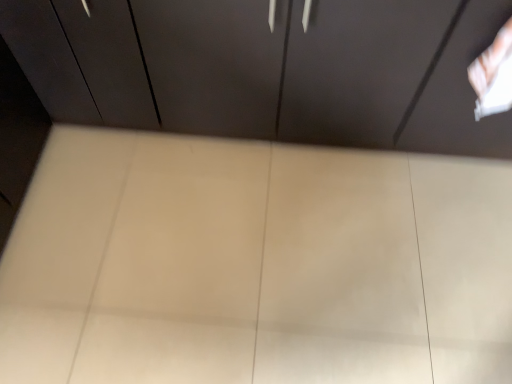
Locate an element on the screen. white glossy plywood at center is located at coordinates (255, 264).

The width and height of the screenshot is (512, 384). What do you see at coordinates (255, 264) in the screenshot?
I see `white glossy plywood at center` at bounding box center [255, 264].

Measure the distance between point (352, 310) and camera.

4.22 feet.

The height and width of the screenshot is (384, 512). What are the coordinates of `matte dark wood cupboard at center` in the screenshot? It's located at (268, 68).

This screenshot has width=512, height=384. What do you see at coordinates (268, 68) in the screenshot?
I see `matte dark wood cupboard at center` at bounding box center [268, 68].

In order to face matte dark wood cupboard at center, should I rotate leftwards or rightwards?

To face it directly, rotate right by 6.460 degrees.

Identify the location of white glossy plywood at center. The width and height of the screenshot is (512, 384). (255, 264).

Based on the photo, considering the positions of objects white glossy plywood at center and matte dark wood cupboard at center in the image provided, who is more to the right, white glossy plywood at center or matte dark wood cupboard at center?

matte dark wood cupboard at center is more to the right.

Is the position of white glossy plywood at center less distant than that of matte dark wood cupboard at center?

No, it is not.

Is point (103, 161) behind point (67, 12)?

Yes.

From the image's perspective, is white glossy plywood at center on top of matte dark wood cupboard at center?

Actually, white glossy plywood at center appears below matte dark wood cupboard at center in the image.

From a real-world perspective, is white glossy plywood at center positioned under matte dark wood cupboard at center based on gravity?

Yes, from a real-world perspective, white glossy plywood at center is under matte dark wood cupboard at center.

In the scene shown: Is white glossy plywood at center thinner than matte dark wood cupboard at center?

Incorrect, the width of white glossy plywood at center is not less than that of matte dark wood cupboard at center.

Considering the sizes of objects white glossy plywood at center and matte dark wood cupboard at center in the image provided, who is shorter, white glossy plywood at center or matte dark wood cupboard at center?

white glossy plywood at center is shorter.

In terms of size, does white glossy plywood at center appear bigger or smaller than matte dark wood cupboard at center?

Considering their sizes, white glossy plywood at center takes up less space than matte dark wood cupboard at center.

Is white glossy plywood at center outside of matte dark wood cupboard at center?

white glossy plywood at center lies outside matte dark wood cupboard at center's area.

Looking at this image, is white glossy plywood at center positioned far away from matte dark wood cupboard at center?

They are positioned close to each other.

Is matte dark wood cupboard at center at the back of white glossy plywood at center?

No, white glossy plywood at center's orientation is not away from matte dark wood cupboard at center.

Where is `plywood that is behind the matte dark wood cupboard at center`? plywood that is behind the matte dark wood cupboard at center is located at coordinates (255, 264).

Between matte dark wood cupboard at center and white glossy plywood at center, which one appears on the right side from the viewer's perspective?

matte dark wood cupboard at center.

Is matte dark wood cupboard at center in front of white glossy plywood at center?

Yes, matte dark wood cupboard at center is in front of white glossy plywood at center.

Which is less distant, (153, 122) or (52, 372)?

Point (153, 122) is farther from the camera than point (52, 372).

From the image's perspective, between matte dark wood cupboard at center and white glossy plywood at center, who is located below?

white glossy plywood at center.

From the picture: From a real-world perspective, is matte dark wood cupboard at center beneath white glossy plywood at center?

No.

Does matte dark wood cupboard at center have a lesser width compared to white glossy plywood at center?

Correct, the width of matte dark wood cupboard at center is less than that of white glossy plywood at center.

Who is shorter, matte dark wood cupboard at center or white glossy plywood at center?

Standing shorter between the two is white glossy plywood at center.

Is matte dark wood cupboard at center smaller than white glossy plywood at center?

No.

Is matte dark wood cupboard at center positioned beyond the bounds of white glossy plywood at center?

Indeed, matte dark wood cupboard at center is completely outside white glossy plywood at center.

Is matte dark wood cupboard at center far away from white glossy plywood at center?

No, matte dark wood cupboard at center is not far from white glossy plywood at center.

Is matte dark wood cupboard at center looking in the opposite direction of white glossy plywood at center?

No.

Locate an element on the screen. This screenshot has height=384, width=512. plywood that is behind the matte dark wood cupboard at center is located at coordinates (255, 264).

What are the coordinates of `plywood below the matte dark wood cupboard at center (from a real-world perspective)` in the screenshot? It's located at (255, 264).

Where is `plywood behind the matte dark wood cupboard at center`? This screenshot has width=512, height=384. plywood behind the matte dark wood cupboard at center is located at coordinates (255, 264).